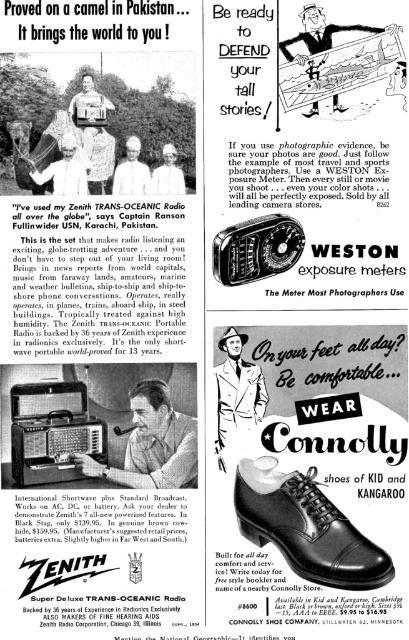
Question: Which of the following is the farthest from the observer?

Choices:
 (A) matte black suit at upper center
 (B) matte black radio at center
 (C) matte black radio at upper left
 (D) matte black suit at center

Answer: (D)

Question: Is black leather shoes at lower right thinner than white matte uniform at center?

Choices:
 (A) no
 (B) yes

Answer: (A)

Question: From the image, what is the correct spatial relationship of matte black suit at upper center in relation to matte black radio at center?

Choices:
 (A) below
 (B) above

Answer: (B)

Question: Can you confirm if matte black suit at center is positioned to the left of white matte hat at center?

Choices:
 (A) no
 (B) yes

Answer: (A)

Question: Which point is farther from the camera taking this photo?

Choices:
 (A) (170, 177)
 (B) (139, 476)
 (C) (137, 179)

Answer: (B)

Question: Which object appears closest to the camera in this image?

Choices:
 (A) matte black suit at center
 (B) matte black radio at upper left

Answer: (B)